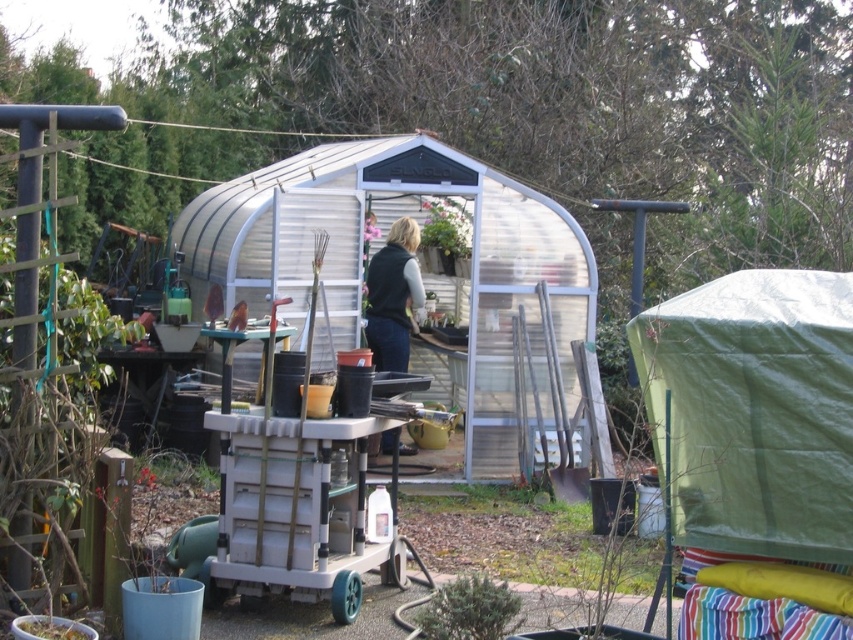
You are a gardener who wants to retrieve the dark green fabric vest at center from the green matte bush at lower center. Can you reach it without moving the bush?

The dark green fabric vest at center is located above the green matte bush at lower center, so you can reach it without needing to move the bush.

You are a gardener who needs to move the green matte pot at center into the transparent plastic greenhouse at center. Given that the greenhouse is bigger than the pot, will the pot fit inside the greenhouse?

The transparent plastic greenhouse at center is bigger than the green matte pot at center, so the pot will fit inside the greenhouse.

You are a gardener who needs to place a new plant in the garden. You have a small plant that requires a container slightly larger than its current size. Which object between the green matte bush at lower center and the green matte pot at center would be a better choice for repotting the plant?

The green matte pot at center is a better choice because it has a larger size compared to the green matte bush at lower center.